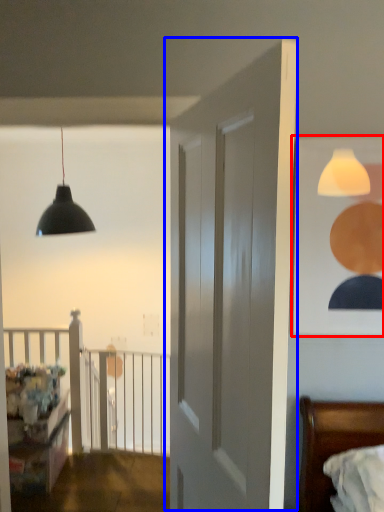
Question: Which object appears closest to the camera in this image, picture frame (highlighted by a red box) or door (highlighted by a blue box)?

Choices:
 (A) picture frame
 (B) door

Answer: (B)